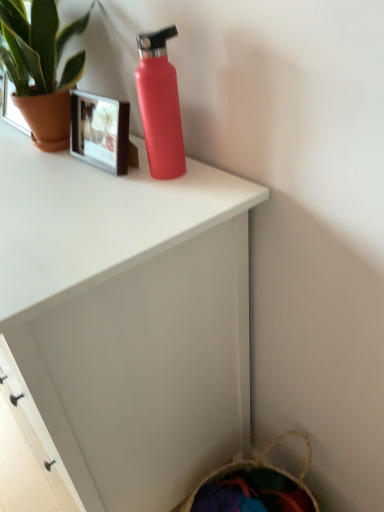
This screenshot has width=384, height=512. In order to click on vacant space to the right of matte pink bottle at upper center in this screenshot , I will do `click(216, 170)`.